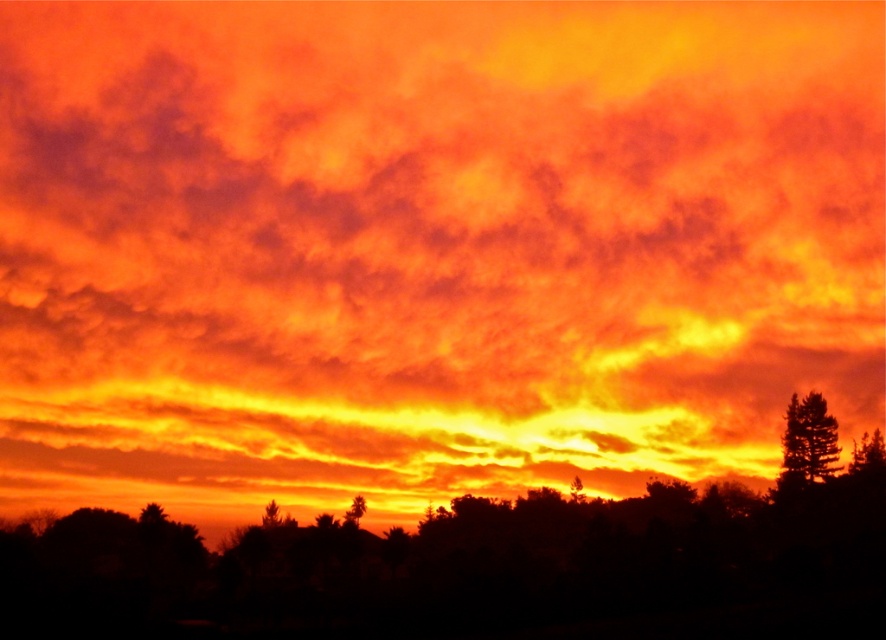
Who is shorter, silhouette tree at center or silhouette tree at lower center?

silhouette tree at lower center is shorter.

Locate an element on the screen. This screenshot has width=886, height=640. silhouette tree at center is located at coordinates (473, 566).

Does silky brown pine tree at right lie behind green leafy tree at center?

Yes, it is.

Locate an element on the screen. This screenshot has height=640, width=886. silky brown pine tree at right is located at coordinates pyautogui.click(x=807, y=442).

Which of these two, silhouette tree at center or silky brown pine tree at right, stands taller?

With more height is silky brown pine tree at right.

Describe the element at coordinates (473, 566) in the screenshot. I see `silhouette tree at center` at that location.

Between point (571, 566) and point (811, 454), which one is positioned behind?

Point (811, 454)

Image resolution: width=886 pixels, height=640 pixels. Find the location of `silhouette tree at center`. silhouette tree at center is located at coordinates (473, 566).